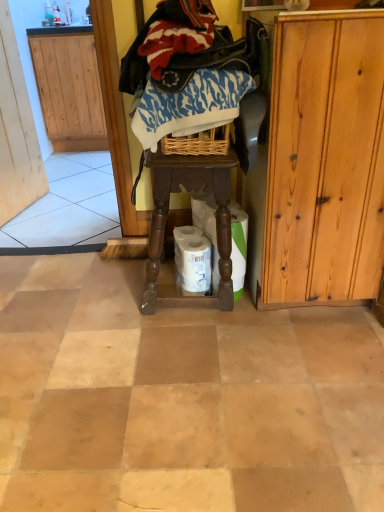
Question: Can you confirm if wooden screen door at left is positioned to the right of knitted wool sweater at upper center, acting as the 2th clothing starting from the bottom?

Choices:
 (A) yes
 (B) no

Answer: (B)

Question: Is wooden screen door at left wider than knitted wool sweater at upper center, placed as the first clothing when sorted from top to bottom?

Choices:
 (A) no
 (B) yes

Answer: (A)

Question: Can we say wooden screen door at left lies outside knitted wool sweater at upper center, placed as the first clothing when sorted from top to bottom?

Choices:
 (A) no
 (B) yes

Answer: (B)

Question: Would you say wooden screen door at left is a long distance from knitted wool sweater at upper center, acting as the 2th clothing starting from the bottom?

Choices:
 (A) no
 (B) yes

Answer: (B)

Question: Does wooden screen door at left have a smaller size compared to knitted wool sweater at upper center, acting as the 2th clothing starting from the bottom?

Choices:
 (A) yes
 (B) no

Answer: (A)

Question: From the image's perspective, is white matte toilet paper at center, acting as the 1th toilet paper starting from the right, above or below light brown wood cabinet at right?

Choices:
 (A) above
 (B) below

Answer: (B)

Question: In terms of width, does white matte toilet paper at center, acting as the 1th toilet paper starting from the right, look wider or thinner when compared to light brown wood cabinet at right?

Choices:
 (A) thin
 (B) wide

Answer: (A)

Question: Based on their sizes in the image, would you say white matte toilet paper at center, which is the second toilet paper from left to right, is bigger or smaller than light brown wood cabinet at right?

Choices:
 (A) big
 (B) small

Answer: (B)

Question: In terms of height, does white matte toilet paper at center, acting as the 1th toilet paper starting from the right, look taller or shorter compared to light brown wood cabinet at right?

Choices:
 (A) tall
 (B) short

Answer: (B)

Question: In terms of size, does brown wooden stool at center appear bigger or smaller than blue printed fabric at center, the first clothing when ordered from bottom to top?

Choices:
 (A) big
 (B) small

Answer: (A)

Question: Is point (231, 269) closer or farther from the camera than point (233, 72)?

Choices:
 (A) farther
 (B) closer

Answer: (A)

Question: From the image's perspective, is brown wooden stool at center above or below blue printed fabric at center, the first clothing when ordered from bottom to top?

Choices:
 (A) above
 (B) below

Answer: (B)

Question: In terms of width, does brown wooden stool at center look wider or thinner when compared to blue printed fabric at center, the first clothing when ordered from bottom to top?

Choices:
 (A) wide
 (B) thin

Answer: (A)

Question: From the image's perspective, is brown wooden stool at center above or below light brown wood cabinet at right?

Choices:
 (A) above
 (B) below

Answer: (B)

Question: Considering the relative positions of brown wooden stool at center and light brown wood cabinet at right in the image provided, is brown wooden stool at center to the left or to the right of light brown wood cabinet at right?

Choices:
 (A) left
 (B) right

Answer: (A)